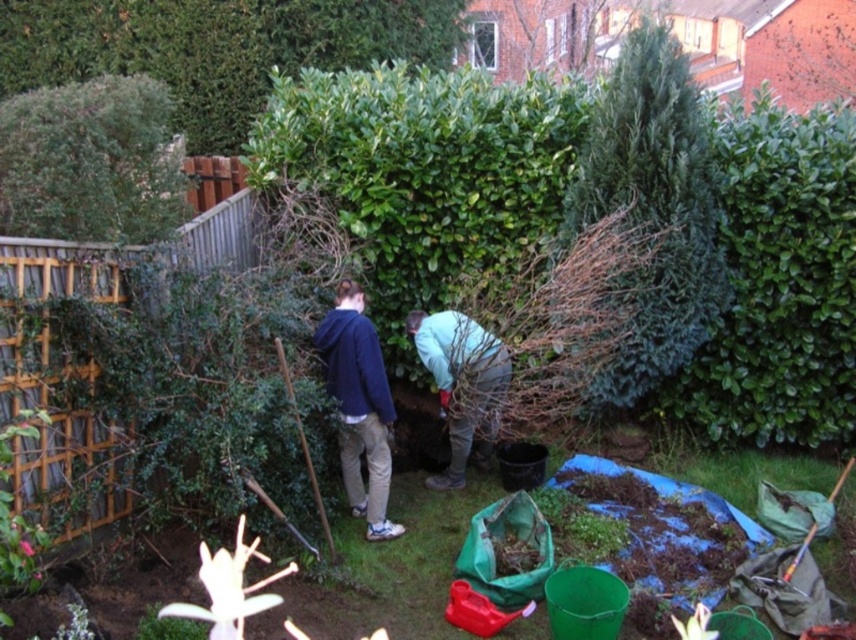
Looking at this image, you are standing in the garden and want to reach the green textured tree at upper right to water it. There is a blue fleece jacket at center in your path. Which object will you encounter first?

You will encounter the blue fleece jacket at center first because the green textured tree at upper right is further away from you than the blue fleece jacket at center.

You are a gardener who needs to place a 4 feet long ladder between the green textured tree at upper right and the light blue fabric at center. Is there enough space for the ladder?

The green textured tree at upper right is 3.90 feet from the light blue fabric at center. Since the ladder is 4 feet long, there isn not enough space to place it between them.